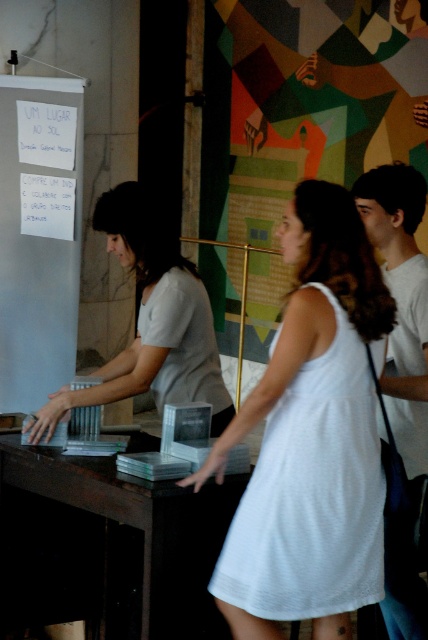
You are a customer in this space and want to place a small item between the white paper at left and the white cotton shirt at right. Can you fit it there?

The white paper at left is taller than the white cotton shirt at right, so there might be space between them to place a small item.

You are a customer in the cafe and you want to place an order. You see the white paper at left and the white matte dress at center. Which object is closer to the left side of the counter?

The white paper at left is positioned on the left side of the white matte dress at center, so it is closer to the left side of the counter.

Consider the image. You are a customer in a store and you see the white cotton dress at center and the white cotton shirt at right. You want to pick up both items to try them on. Can you reach both items without moving your position?

The white cotton dress at center and white cotton shirt at right are 22.74 inches apart from each other. If your arms can reach across that distance, you can pick up both items without moving your position.